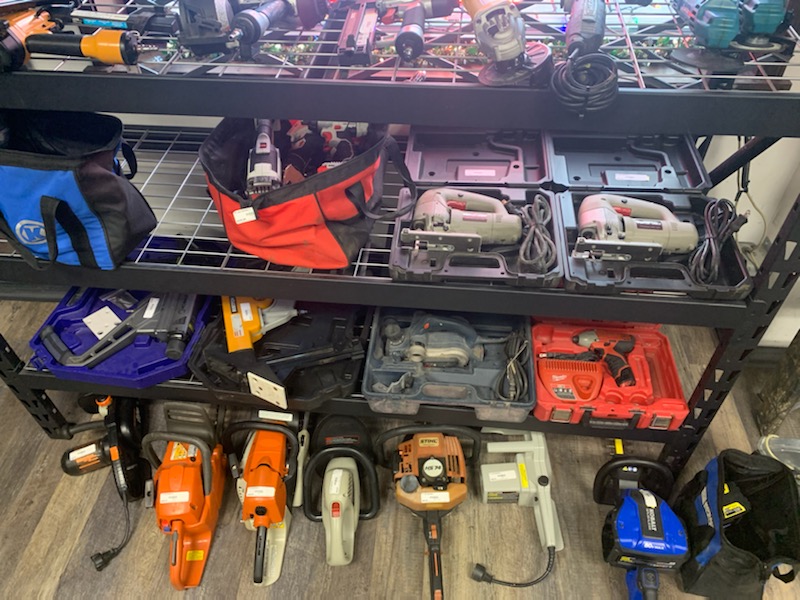
Identify the location of hardwood floor. The image size is (800, 600). (34, 505).